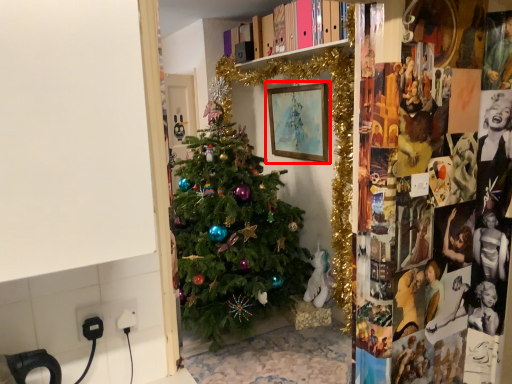
Question: In this image, where is picture frame (annotated by the red box) located relative to electric outlet?

Choices:
 (A) left
 (B) right

Answer: (B)